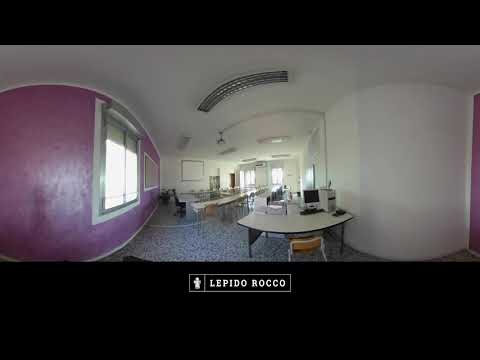
Image resolution: width=480 pixels, height=360 pixels. Find the location of `5 overhead ceiling lights`. 5 overhead ceiling lights is located at coordinates (282, 141), (223, 141), (186, 142), (230, 151), (231, 88).